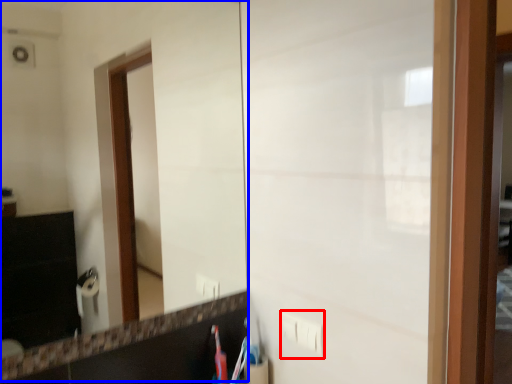
Question: Which object is closer to the camera taking this photo, electric outlet (highlighted by a red box) or mirror (highlighted by a blue box)?

Choices:
 (A) electric outlet
 (B) mirror

Answer: (B)